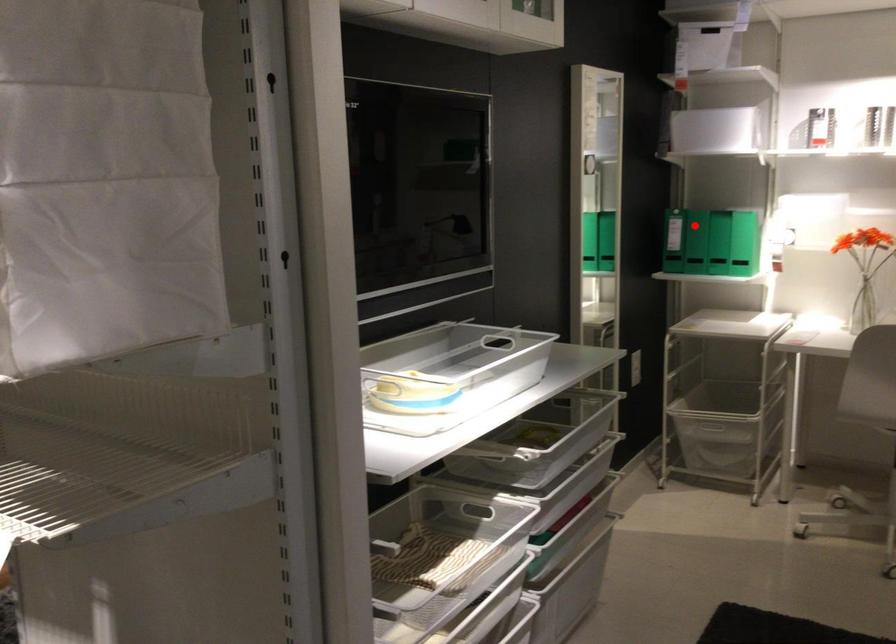
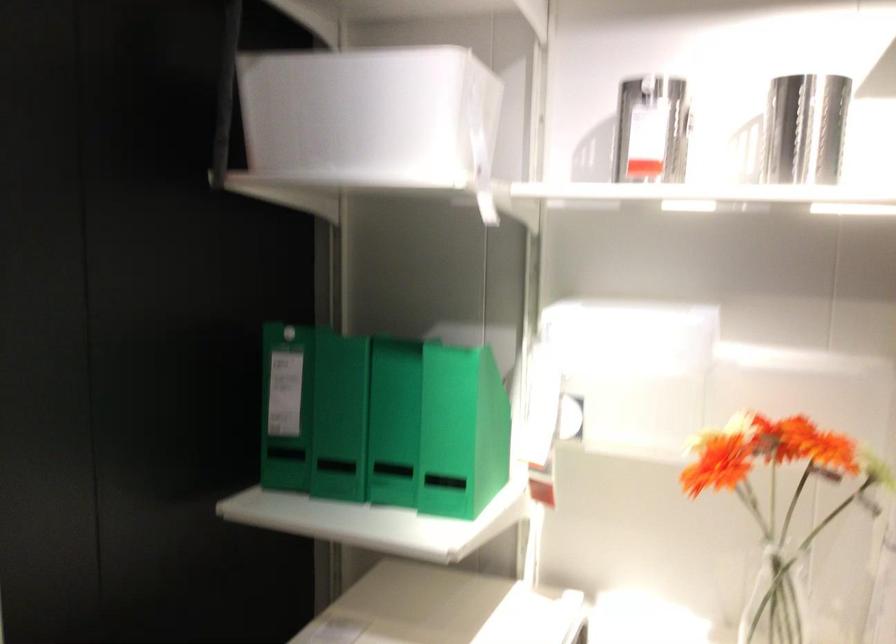
Question: I am providing you with two images of the same scene from different viewpoints. Given a red point in image1, look at the same physical point in image2. Is it:

Choices:
 (A) Closer to the viewpoint
 (B) Farther from the viewpoint

Answer: (A)